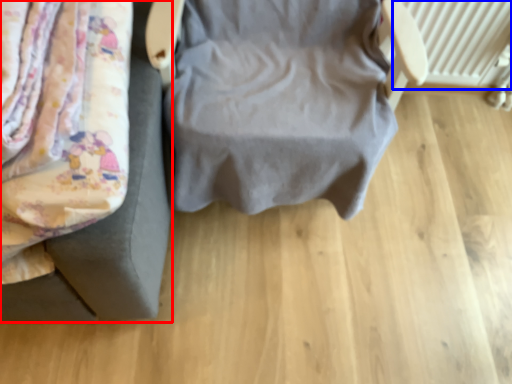
Question: Which object is closer to the camera taking this photo, furniture (highlighted by a red box) or radiator (highlighted by a blue box)?

Choices:
 (A) furniture
 (B) radiator

Answer: (A)